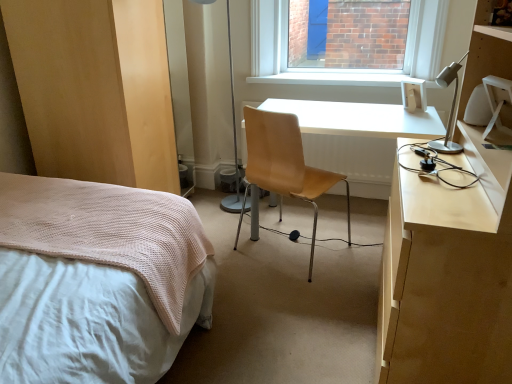
Find the location of `vacant space in between white glossy desk at center and light brown leather chair at center`. vacant space in between white glossy desk at center and light brown leather chair at center is located at coordinates (344, 274).